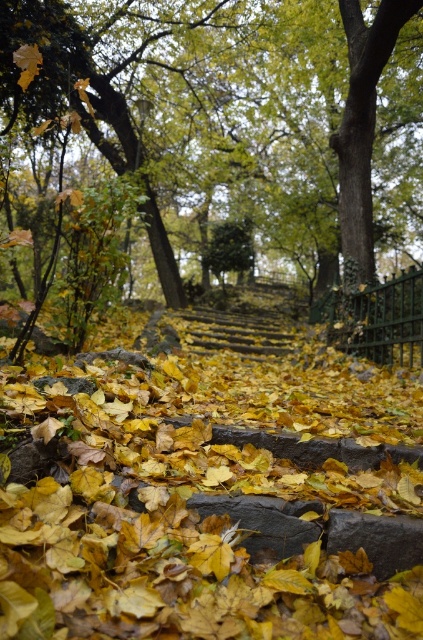
Question: Which object is farther from the camera taking this photo?

Choices:
 (A) yellow leaf litter at center
 (B) green leafy tree at center

Answer: (B)

Question: Among these objects, which one is nearest to the camera?

Choices:
 (A) yellow leaf litter at center
 (B) green leafy tree at center

Answer: (A)

Question: Where is yellow leaf litter at center located in relation to green leafy tree at center in the image?

Choices:
 (A) below
 (B) above

Answer: (A)

Question: Does yellow leaf litter at center have a lesser width compared to green leafy tree at center?

Choices:
 (A) yes
 (B) no

Answer: (A)

Question: From the image, what is the correct spatial relationship of yellow leaf litter at center in relation to green leafy tree at center?

Choices:
 (A) below
 (B) above

Answer: (A)

Question: Which point is farther from the camera taking this photo?

Choices:
 (A) (395, 29)
 (B) (194, 621)

Answer: (A)